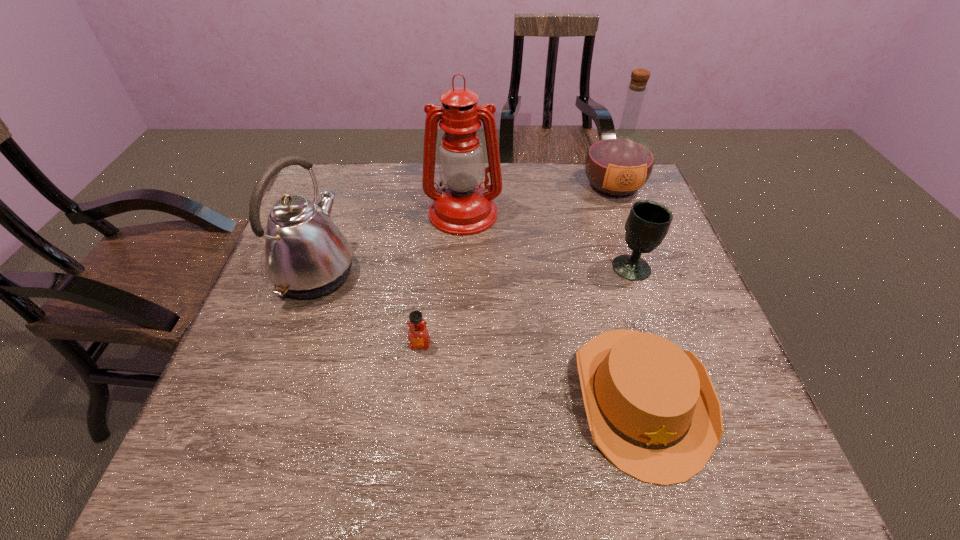
Identify the location of vacant region at the far edge. (543, 163).

This screenshot has height=540, width=960. In order to click on free space at the near edge in this screenshot , I will do `click(506, 474)`.

You are a GUI agent. You are given a task and a screenshot of the screen. Output one action in this format:
    pyautogui.click(x=<x>, y=<y>)
    Task: Click on the vacant space at the right edge
    
    Given the screenshot: What is the action you would take?
    pyautogui.click(x=741, y=410)

Where is `free space at the near left corner`? free space at the near left corner is located at coordinates (257, 444).

Where is `free space between the honey and the kettle`? This screenshot has height=540, width=960. free space between the honey and the kettle is located at coordinates (368, 309).

The width and height of the screenshot is (960, 540). Find the location of `free space that is in between the leftmost object and the oil lamp`. free space that is in between the leftmost object and the oil lamp is located at coordinates (390, 244).

You are a GUI agent. You are given a task and a screenshot of the screen. Output one action in this format:
    pyautogui.click(x=<x>, y=<y>)
    Task: Click on the vacant space in between the kettle and the cowboy hat
    This screenshot has height=540, width=960.
    Given the screenshot: What is the action you would take?
    pyautogui.click(x=478, y=335)

Find the location of a particular element. free space between the oil lamp and the kettle is located at coordinates (390, 244).

Locate an element on the screen. The height and width of the screenshot is (540, 960). vacant region between the kettle and the third shortest object is located at coordinates (474, 270).

The height and width of the screenshot is (540, 960). Identify the location of free space between the cowboy hat and the liquor. (627, 292).